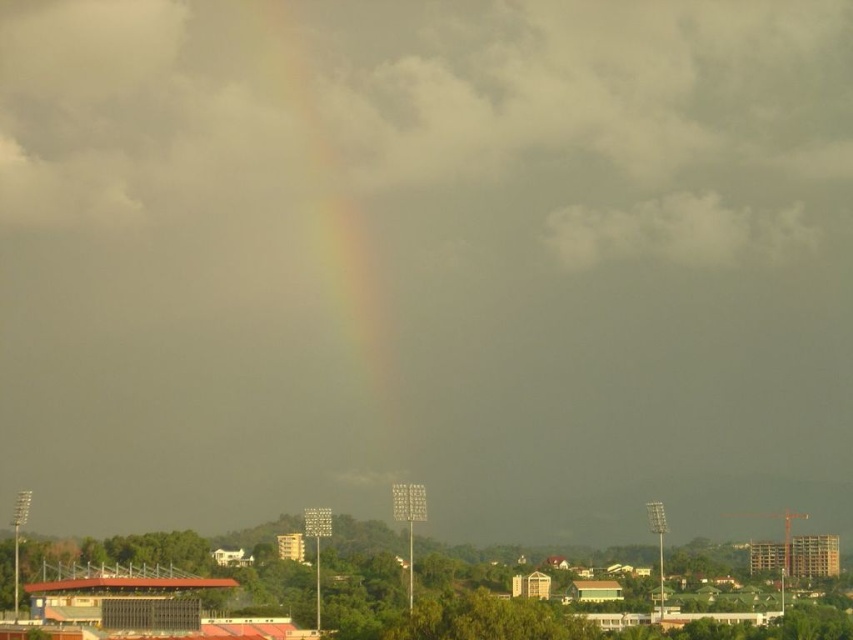
Question: Is rainbow at center positioned at the back of gray cotton cloud at upper center?

Choices:
 (A) no
 (B) yes

Answer: (A)

Question: Which point is closer to the camera?

Choices:
 (A) (675, 200)
 (B) (403, 474)

Answer: (B)

Question: Can you confirm if rainbow at center is positioned below gray cotton cloud at upper center?

Choices:
 (A) no
 (B) yes

Answer: (B)

Question: Which of the following is the farthest from the observer?

Choices:
 (A) (549, 234)
 (B) (283, 38)

Answer: (B)

Question: Can you confirm if rainbow at center is thinner than gray cotton cloud at upper center?

Choices:
 (A) yes
 (B) no

Answer: (A)